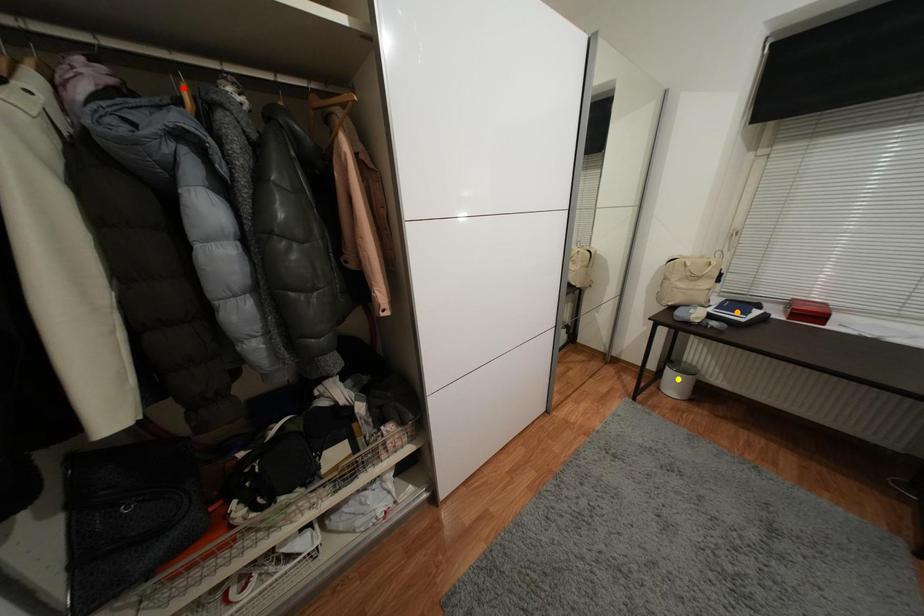
Order these from nearest to farthest:
- orange point
- yellow point
- red point

red point
orange point
yellow point